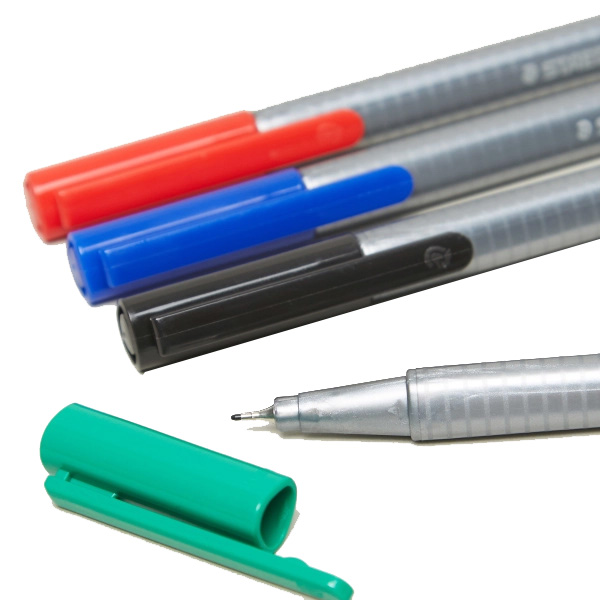
Locate an element on the screen. The height and width of the screenshot is (600, 600). pens is located at coordinates (480, 49), (517, 121), (528, 214), (519, 420).